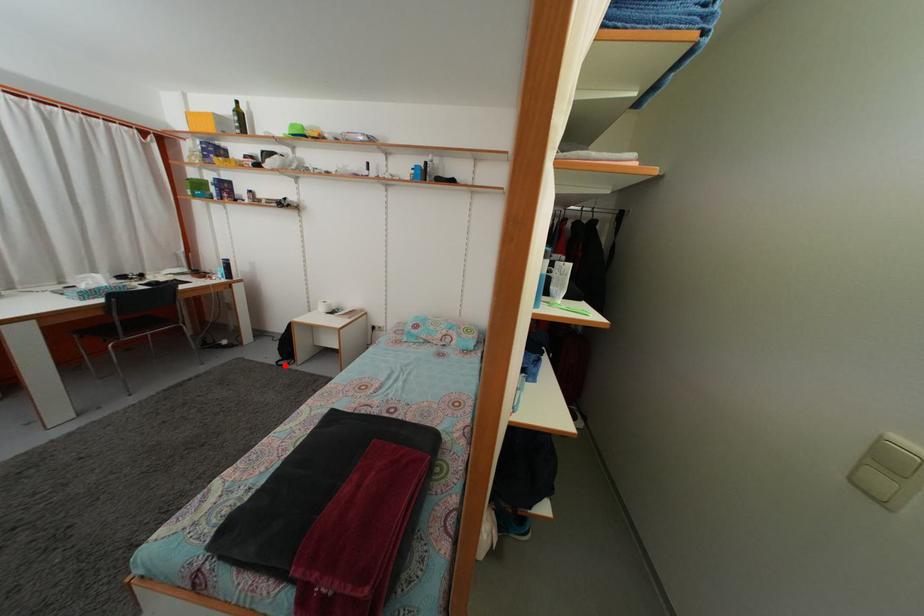
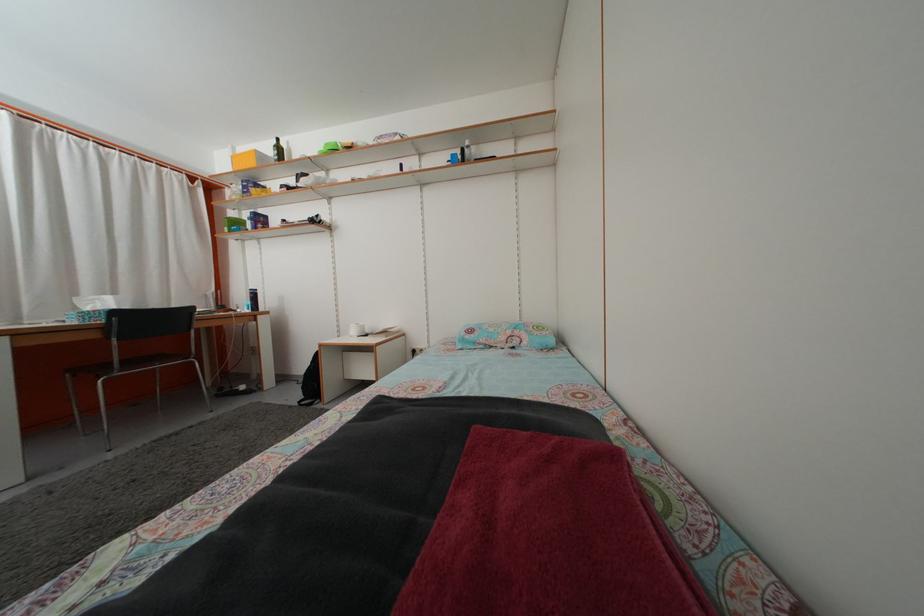
Locate, in the second image, the point that corresponds to the highlighted location in the first image.

(309, 405)